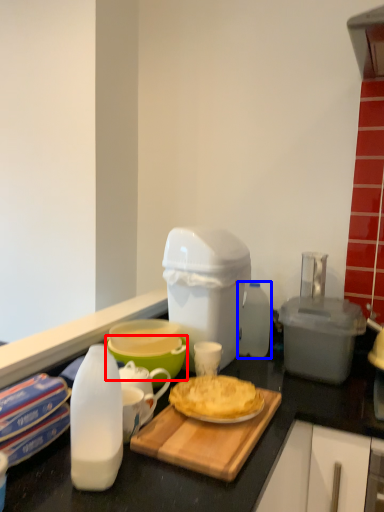
Question: Which of the following is the closest to the observer, bowl (highlighted by a red box) or bottle (highlighted by a blue box)?

Choices:
 (A) bowl
 (B) bottle

Answer: (A)